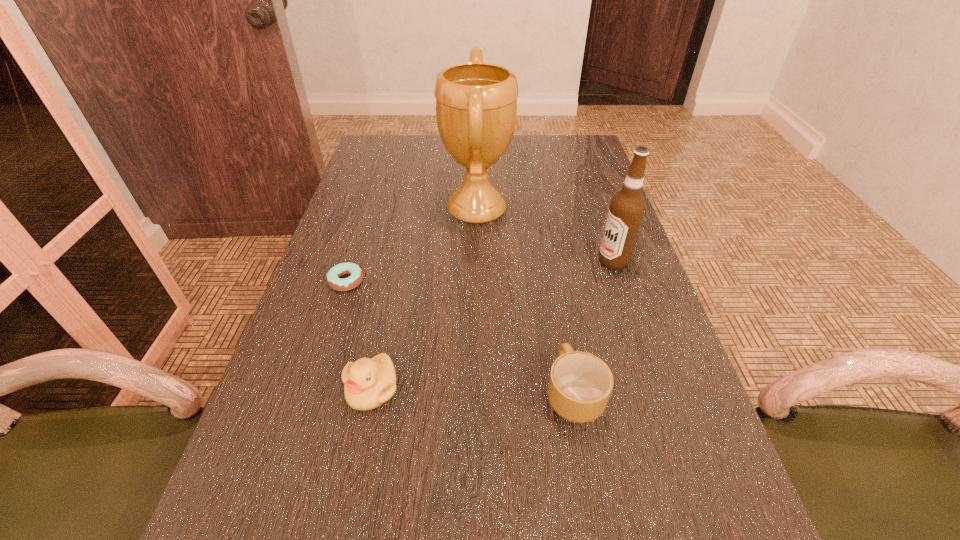
I want to click on award, so click(476, 103).

At what (x,y) coordinates should I click in order to perform the action: click on the tallest object. Please return your answer as a coordinate pair (x, y). This screenshot has height=540, width=960. Looking at the image, I should click on pos(476,103).

The image size is (960, 540). I want to click on the second tallest object, so click(x=627, y=206).

Identify the location of alcohol. This screenshot has width=960, height=540. coord(627,206).

You are a GUI agent. You are given a task and a screenshot of the screen. Output one action in this format:
    pyautogui.click(x=<x>, y=<y>)
    Task: Click on the duckling
    The width and height of the screenshot is (960, 540).
    Given the screenshot: What is the action you would take?
    pyautogui.click(x=368, y=383)

In order to click on mug in this screenshot , I will do `click(580, 385)`.

I want to click on the shortest object, so click(x=333, y=276).

Image resolution: width=960 pixels, height=540 pixels. What are the coordinates of `the leftmost object` in the screenshot? It's located at (333, 276).

The image size is (960, 540). Identify the location of vacant point located on the front of the award with the decoration. (570, 210).

The width and height of the screenshot is (960, 540). I want to click on vacant space located on the label of the second tallest object, so click(x=456, y=261).